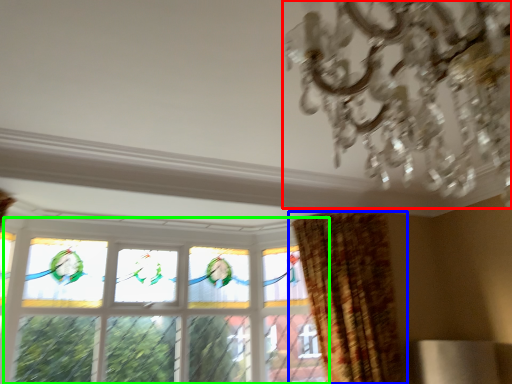
Question: Estimate the real-world distances between objects in this image. Which object is closer to chandelier (highlighted by a red box), curtain (highlighted by a blue box) or window (highlighted by a green box)?

Choices:
 (A) curtain
 (B) window

Answer: (A)